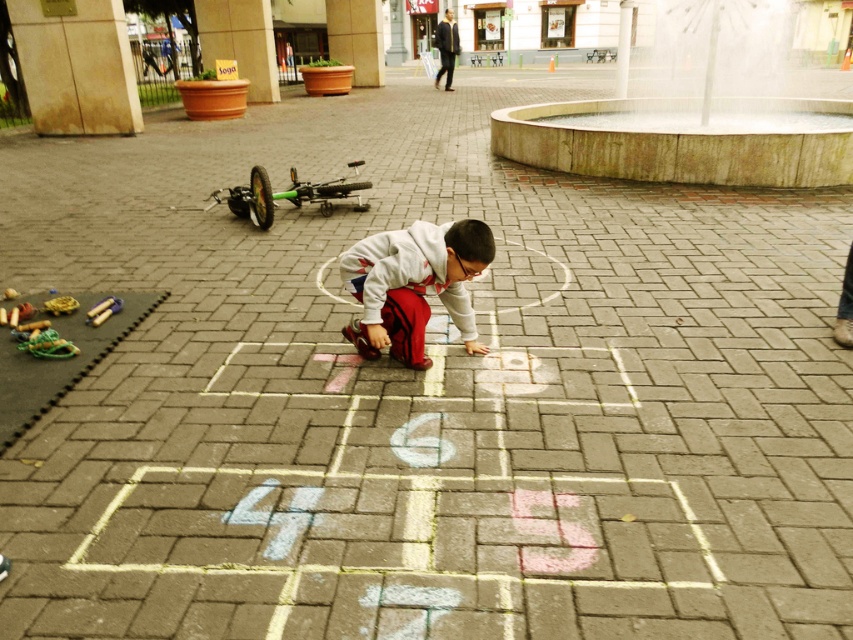
This screenshot has height=640, width=853. Describe the element at coordinates (669, 138) in the screenshot. I see `stone fountain at center` at that location.

You are a GUI agent. You are given a task and a screenshot of the screen. Output one action in this format:
    pyautogui.click(x=<x>, y=<y>)
    Task: Click on the stone fountain at center
    
    Given the screenshot: What is the action you would take?
    pyautogui.click(x=669, y=138)

Does point (637, 172) come in front of point (418, 289)?

No, it is behind (418, 289).

Image resolution: width=853 pixels, height=640 pixels. What are the coordinates of `stone fountain at center` in the screenshot? It's located at click(x=669, y=138).